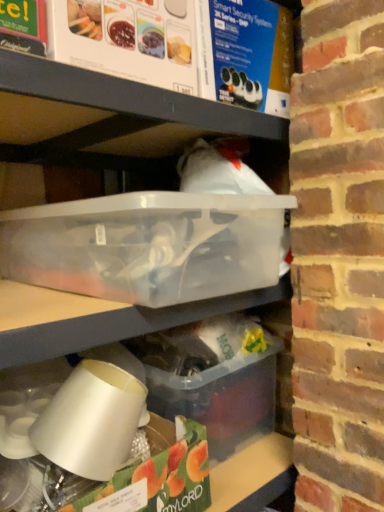
Question: Which direction should I rotate to look at translucent plastic container at lower center, which is counted as the second box, starting from the top?

Choices:
 (A) right
 (B) left

Answer: (A)

Question: Considering the relative positions of transparent plastic container at center, the 2th box from the bottom, and translucent plastic container at lower center, which is counted as the second box, starting from the top, in the image provided, is transparent plastic container at center, the 2th box from the bottom, behind translucent plastic container at lower center, which is counted as the second box, starting from the top,?

Choices:
 (A) yes
 (B) no

Answer: (B)

Question: Is transparent plastic container at center, the 1th box when ordered from top to bottom, aimed at translucent plastic container at lower center, the first box when ordered from bottom to top?

Choices:
 (A) yes
 (B) no

Answer: (B)

Question: From the image's perspective, would you say transparent plastic container at center, the 1th box when ordered from top to bottom, is shown under translucent plastic container at lower center, which is counted as the second box, starting from the top?

Choices:
 (A) no
 (B) yes

Answer: (A)

Question: From a real-world perspective, is transparent plastic container at center, the 1th box when ordered from top to bottom, positioned over translucent plastic container at lower center, which is counted as the second box, starting from the top, based on gravity?

Choices:
 (A) yes
 (B) no

Answer: (A)

Question: Can you confirm if transparent plastic container at center, the 1th box when ordered from top to bottom, is positioned to the right of translucent plastic container at lower center, the first box when ordered from bottom to top?

Choices:
 (A) no
 (B) yes

Answer: (A)

Question: Is transparent plastic container at center, the 1th box when ordered from top to bottom, positioned beyond the bounds of translucent plastic container at lower center, the first box when ordered from bottom to top?

Choices:
 (A) no
 (B) yes

Answer: (B)

Question: From a real-world perspective, is translucent plastic container at lower center, which is counted as the second box, starting from the top, on top of transparent plastic container at center, the 1th box when ordered from top to bottom?

Choices:
 (A) no
 (B) yes

Answer: (A)

Question: From the image's perspective, does translucent plastic container at lower center, which is counted as the second box, starting from the top, appear lower than transparent plastic container at center, the 2th box from the bottom?

Choices:
 (A) no
 (B) yes

Answer: (B)

Question: Is transparent plastic container at center, the 1th box when ordered from top to bottom, at the back of translucent plastic container at lower center, which is counted as the second box, starting from the top?

Choices:
 (A) yes
 (B) no

Answer: (B)

Question: Considering the relative sizes of translucent plastic container at lower center, the first box when ordered from bottom to top, and transparent plastic container at center, the 2th box from the bottom, in the image provided, is translucent plastic container at lower center, the first box when ordered from bottom to top, smaller than transparent plastic container at center, the 2th box from the bottom,?

Choices:
 (A) yes
 (B) no

Answer: (A)

Question: Is there a large distance between translucent plastic container at lower center, the first box when ordered from bottom to top, and transparent plastic container at center, the 1th box when ordered from top to bottom?

Choices:
 (A) no
 (B) yes

Answer: (A)

Question: Is transparent plastic container at center, the 1th box when ordered from top to bottom, a part of translucent plastic container at lower center, the first box when ordered from bottom to top?

Choices:
 (A) no
 (B) yes

Answer: (A)

Question: Is translucent plastic container at lower center, which is counted as the second box, starting from the top, taller or shorter than transparent plastic container at center, the 1th box when ordered from top to bottom?

Choices:
 (A) short
 (B) tall

Answer: (B)